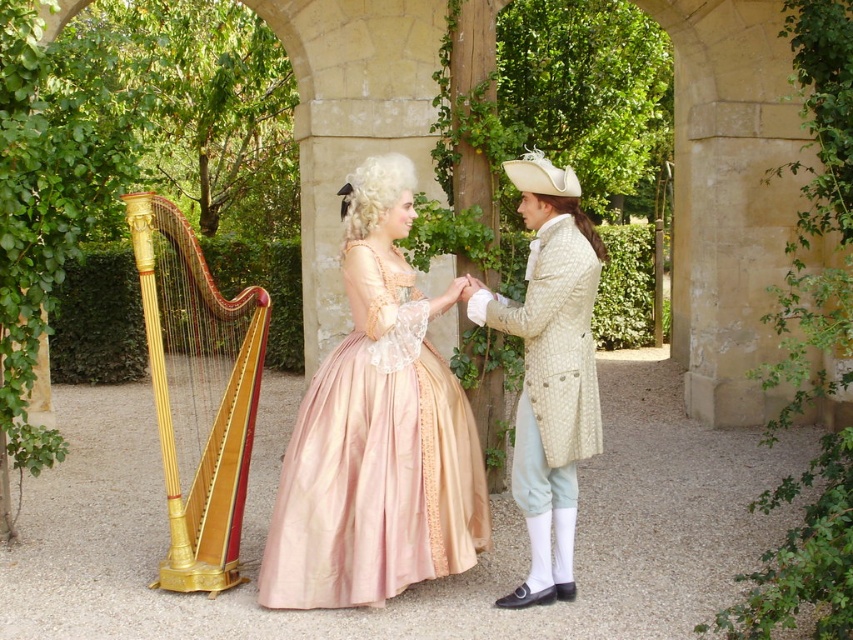
Question: Does pink satin dress at center come in front of gold polished wood harp at left?

Choices:
 (A) yes
 (B) no

Answer: (A)

Question: Which object appears closest to the camera in this image?

Choices:
 (A) pink satin dress at center
 (B) gold polished wood harp at left
 (C) light beige textured coat at center

Answer: (C)

Question: Which point is closer to the camera taking this photo?

Choices:
 (A) (548, 378)
 (B) (427, 435)

Answer: (A)

Question: Is the position of pink satin dress at center less distant than that of light beige textured coat at center?

Choices:
 (A) yes
 (B) no

Answer: (B)

Question: Does pink satin dress at center appear under gold polished wood harp at left?

Choices:
 (A) yes
 (B) no

Answer: (B)

Question: Which point is farther to the camera?

Choices:
 (A) (323, 493)
 (B) (543, 291)

Answer: (A)